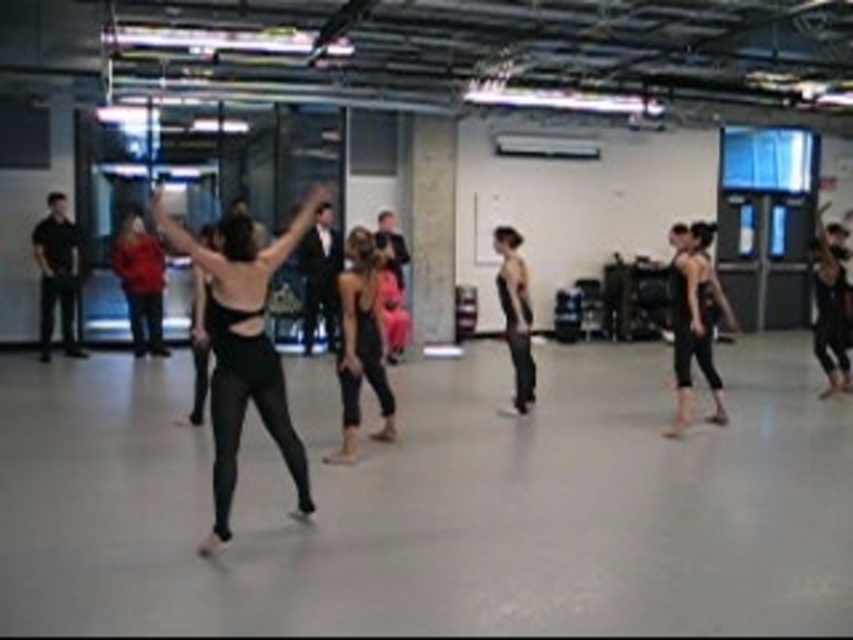
Question: Can you confirm if black matte leggings at center is thinner than matte black tank top at center?

Choices:
 (A) yes
 (B) no

Answer: (B)

Question: Among these objects, which one is farthest from the camera?

Choices:
 (A) matte black tank top at center
 (B) black matte leggings at center

Answer: (A)

Question: Does black matte leggings at center have a smaller size compared to matte black tank top at center?

Choices:
 (A) no
 (B) yes

Answer: (A)

Question: Can you confirm if black matte leggings at center is positioned to the right of matte black tank top at center?

Choices:
 (A) yes
 (B) no

Answer: (B)

Question: Which point is farther to the camera?

Choices:
 (A) black matte leggings at center
 (B) matte black tank top at center

Answer: (B)